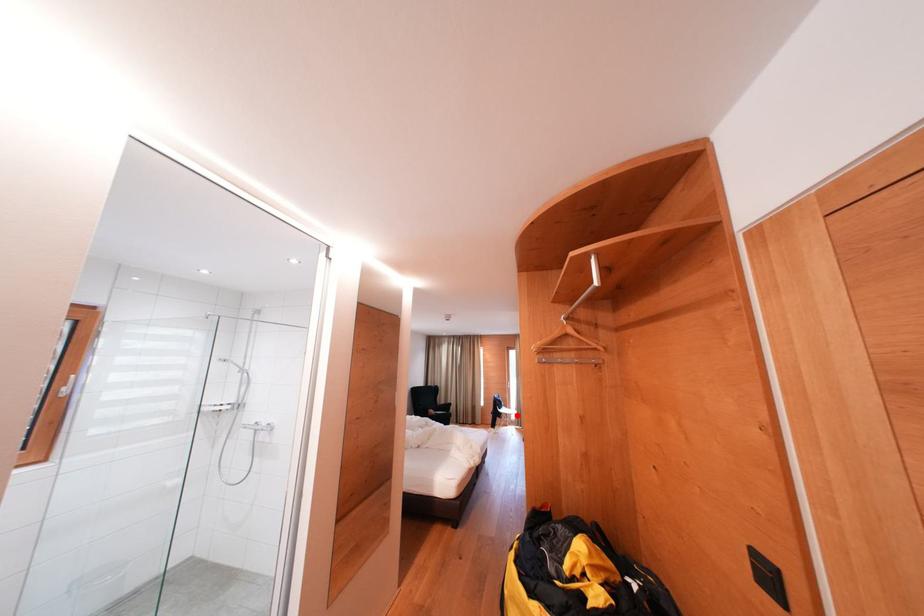
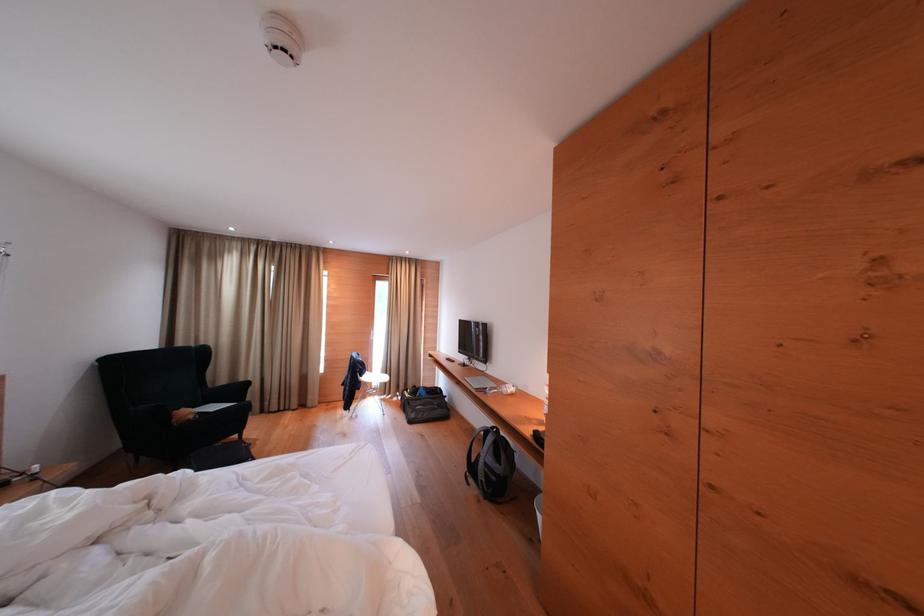
The point at the highlighted location is marked in the first image. Where is the corresponding point in the second image?

(383, 379)